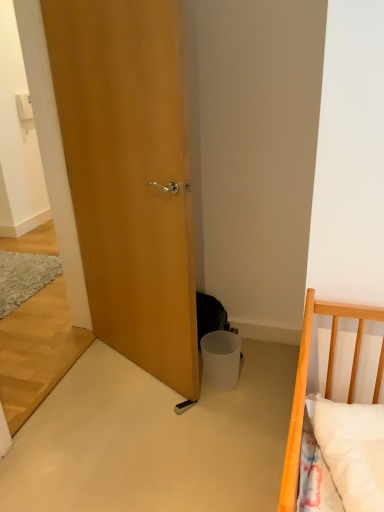
Where is `free point below wooden door at center (from a real-world perspective)`? This screenshot has width=384, height=512. free point below wooden door at center (from a real-world perspective) is located at coordinates (132, 364).